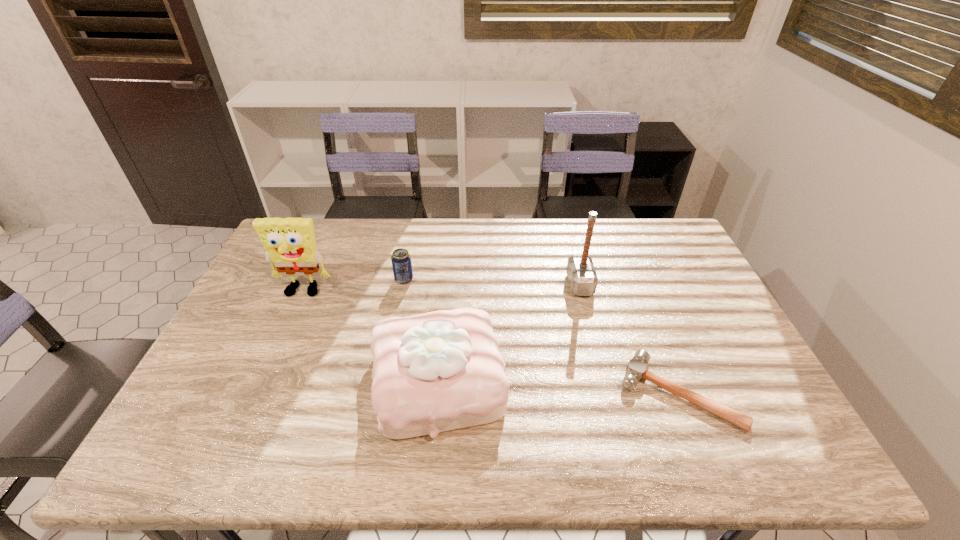
At what (x,y) coordinates should I click in order to perform the action: click on free location located on the face of the sponge. Please return your answer as a coordinate pair (x, y). Looking at the image, I should click on (282, 337).

I want to click on free space located 0.290m on the back of the third shortest object, so click(x=448, y=264).

The image size is (960, 540). Find the location of `free space located 0.070m on the back of the soda`. free space located 0.070m on the back of the soda is located at coordinates (408, 260).

What are the coordinates of `free location located on the left of the shortest object` in the screenshot? It's located at (510, 393).

Image resolution: width=960 pixels, height=540 pixels. I want to click on cake present at the near edge, so click(438, 371).

Identify the location of hammer present at the near edge. (636, 369).

I want to click on object present at the left edge, so click(290, 243).

This screenshot has height=540, width=960. I want to click on object that is positioned at the right edge, so click(636, 369).

Image resolution: width=960 pixels, height=540 pixels. What are the coordinates of `object that is at the near right corner` in the screenshot? It's located at (636, 369).

In the image, there is a desktop. Where is `free region at the far edge`? free region at the far edge is located at coordinates (461, 224).